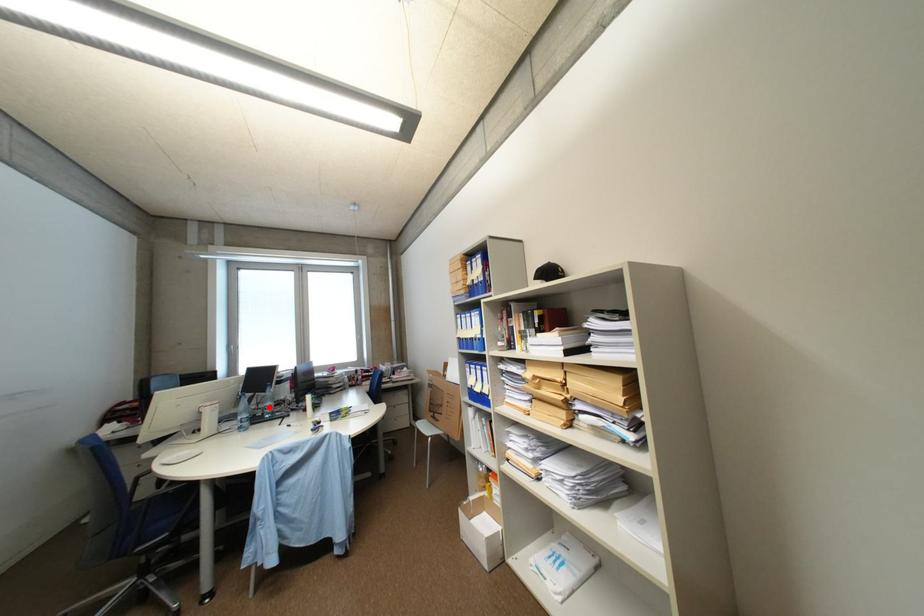
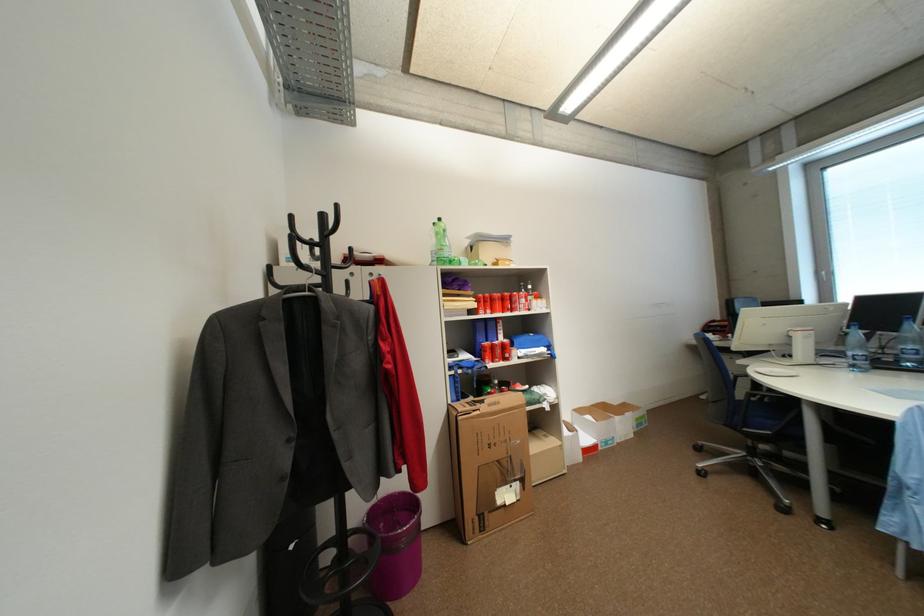
The point at the highlighted location is marked in the first image. Where is the corresponding point in the second image?

(897, 352)